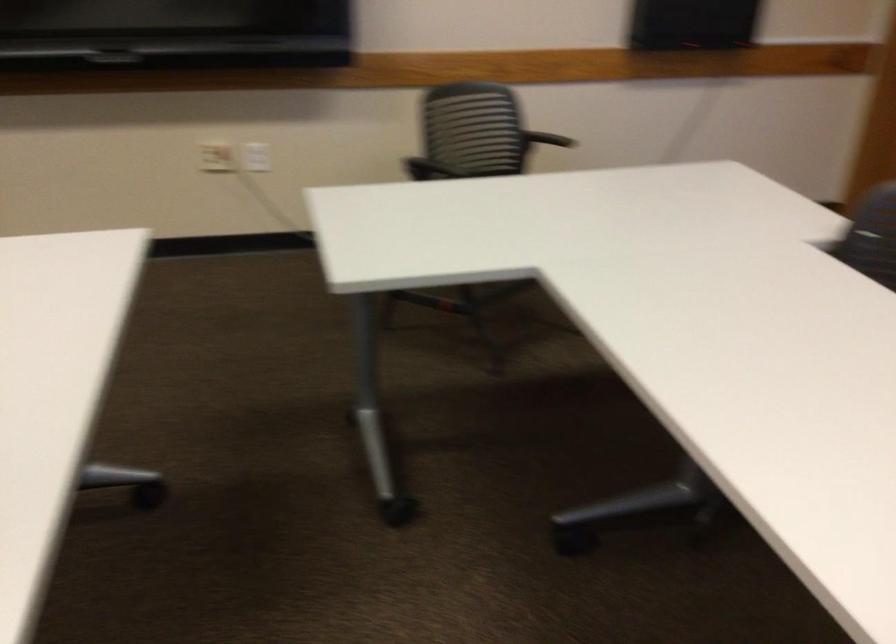
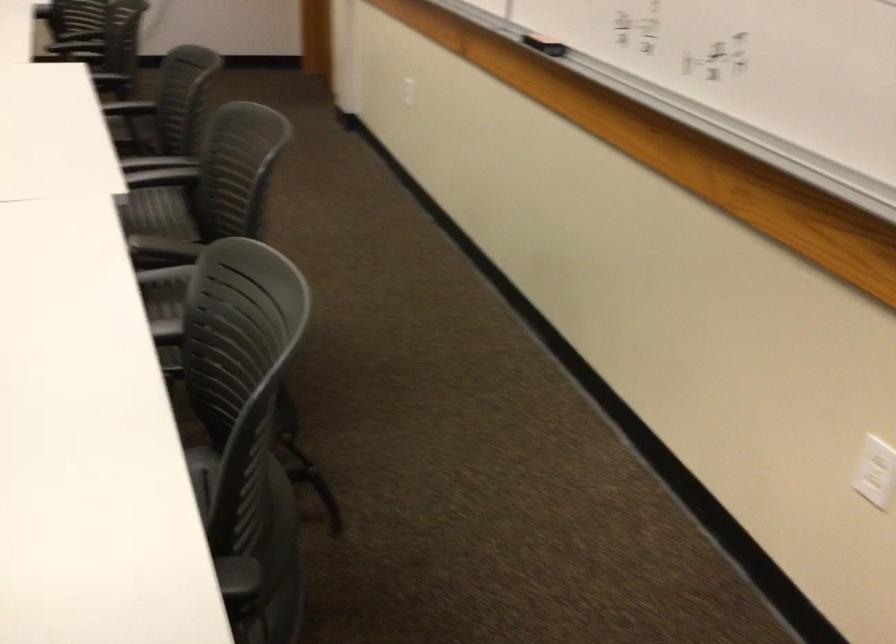
The images are taken continuously from a first-person perspective. In which direction are you moving?

The cameraman walked toward right, backward.